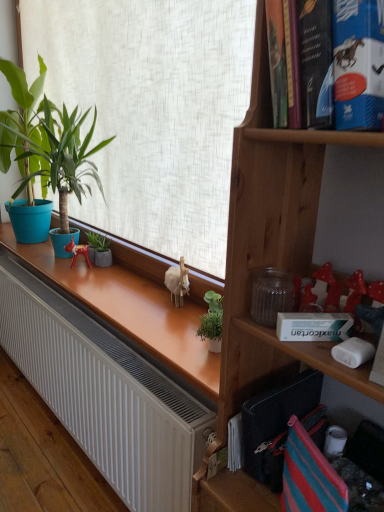
Question: Is blue cardboard book at upper right looking in the opposite direction of green matte planter at center, which is counted as the 1th houseplant, starting from the back?

Choices:
 (A) yes
 (B) no

Answer: (B)

Question: From the image's perspective, does blue cardboard book at upper right appear higher than green matte planter at center, which is the 2th houseplant in front-to-back order?

Choices:
 (A) yes
 (B) no

Answer: (A)

Question: From a real-world perspective, does blue cardboard book at upper right sit lower than green matte planter at center, which is counted as the 1th houseplant, starting from the back?

Choices:
 (A) no
 (B) yes

Answer: (A)

Question: Can you confirm if blue cardboard book at upper right is bigger than green matte planter at center, which is the 1th houseplant in bottom-to-top order?

Choices:
 (A) no
 (B) yes

Answer: (B)

Question: Considering the relative sizes of blue cardboard book at upper right and green matte planter at center, which is counted as the 1th houseplant, starting from the back, in the image provided, is blue cardboard book at upper right wider than green matte planter at center, which is counted as the 1th houseplant, starting from the back,?

Choices:
 (A) yes
 (B) no

Answer: (A)

Question: Is there a large distance between blue cardboard book at upper right and green matte planter at center, which is the 1th houseplant in bottom-to-top order?

Choices:
 (A) no
 (B) yes

Answer: (B)

Question: Can you confirm if green matte planter at center, which is counted as the 1th houseplant, starting from the back, is thinner than white matte radiator at lower left?

Choices:
 (A) no
 (B) yes

Answer: (B)

Question: From the image's perspective, does green matte planter at center, which is counted as the 1th houseplant, starting from the back, appear higher than white matte radiator at lower left?

Choices:
 (A) yes
 (B) no

Answer: (A)

Question: Is green matte planter at center, the 2th houseplant when ordered from top to bottom, oriented away from white matte radiator at lower left?

Choices:
 (A) no
 (B) yes

Answer: (A)

Question: Is the depth of green matte planter at center, which is the 2th houseplant in front-to-back order, less than that of white matte radiator at lower left?

Choices:
 (A) no
 (B) yes

Answer: (A)

Question: Can you confirm if green matte planter at center, the 2th houseplant when ordered from top to bottom, is taller than white matte radiator at lower left?

Choices:
 (A) no
 (B) yes

Answer: (B)

Question: Considering the relative sizes of green matte planter at center, the 2th houseplant when ordered from top to bottom, and white matte radiator at lower left in the image provided, is green matte planter at center, the 2th houseplant when ordered from top to bottom, wider than white matte radiator at lower left?

Choices:
 (A) yes
 (B) no

Answer: (B)

Question: Considering the relative positions of white matte radiator at lower left and green matte plant at left, positioned as the first houseplant in front-to-back order, in the image provided, is white matte radiator at lower left behind green matte plant at left, positioned as the first houseplant in front-to-back order,?

Choices:
 (A) no
 (B) yes

Answer: (A)